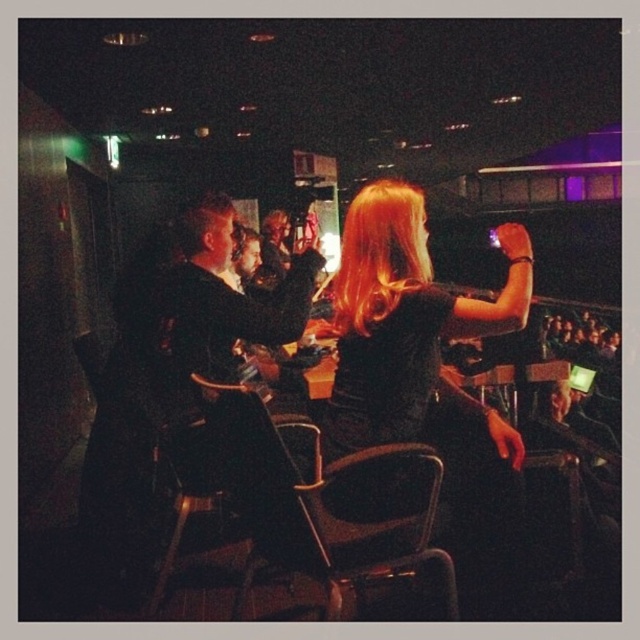
You are a photographer trying to capture a candid shot of the scene. You have a camera with a lens that has a minimum focusing distance of 8 inches. If you want to focus on both the black velvet dress at center and the black leather chair at center clearly in the same photo, will you be able to do so?

The black velvet dress at center is 8.41 inches from the black leather chair at center. Since the minimum focusing distance of your camera lens is 8 inches, which is less than the 8.41 inches between the two objects, you can focus on both the black velvet dress at center and the black leather chair at center clearly in the same photo.

You are standing in the bar and see a point at coordinates (520, 272). If you want to place a drink coaster that is 6 inches in diameter on this point, will it fit without overlapping?

The point at coordinates (520, 272) is 5.53 feet from the viewer. Since the coaster is only 6 inches in diameter, it will fit comfortably without overlapping as there is sufficient space around the point.

You are a photographer trying to capture a clear shot of the black velvet dress at center and the black leather chair at center in the dimly lit bar scene. Since the dress is taller than the chair, which object should you focus on first to ensure both are in frame without adjusting your camera angle?

The black velvet dress at center is taller than the black leather chair at center, so you should focus on the black velvet dress at center first to ensure it fits within the frame while the shorter chair remains in view.